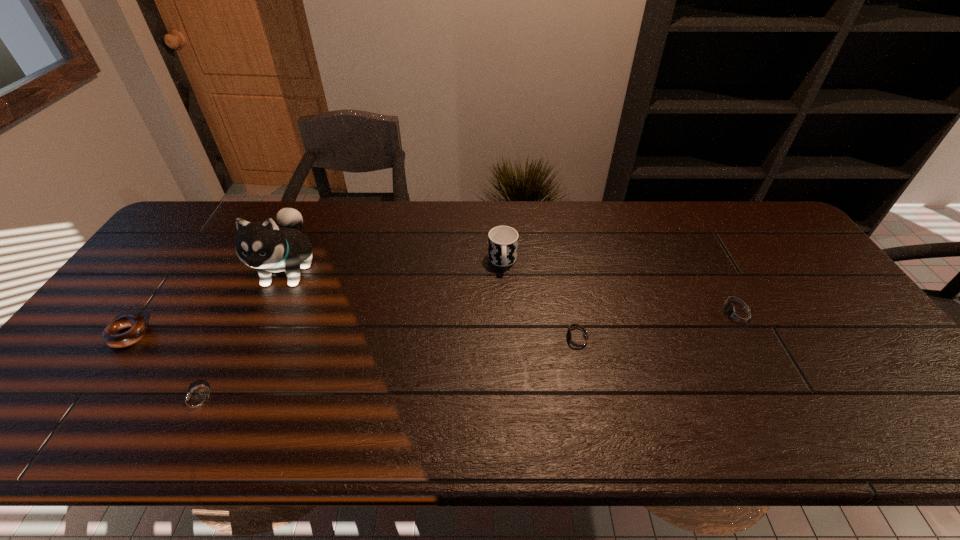
Find the location of `the shortest object`. the shortest object is located at coordinates (196, 401).

Image resolution: width=960 pixels, height=540 pixels. I want to click on the nearest object, so click(196, 401).

At what (x,y) coordinates should I click in order to perform the action: click on the fifth tallest object. Please return your answer as a coordinate pair (x, y). Image resolution: width=960 pixels, height=540 pixels. Looking at the image, I should click on (577, 340).

Where is `the second watch from right to left`? the second watch from right to left is located at coordinates (577, 340).

Identify the location of the rightmost object. The width and height of the screenshot is (960, 540). (738, 315).

Where is `the rightmost watch`? This screenshot has height=540, width=960. the rightmost watch is located at coordinates tap(738, 315).

Find the location of a particular element. The width and height of the screenshot is (960, 540). the leftmost object is located at coordinates (111, 335).

You are a GUI agent. You are given a task and a screenshot of the screen. Output one action in this format:
    pyautogui.click(x=<x>, y=<y>)
    Task: Click on the puppy
    The image size is (960, 540).
    Given the screenshot: What is the action you would take?
    pyautogui.click(x=262, y=245)

Locate an element on the screen. This screenshot has width=960, height=540. the second tallest object is located at coordinates (502, 240).

Locate an element on the screen. This screenshot has height=540, width=960. the fourth object from left to right is located at coordinates (502, 240).